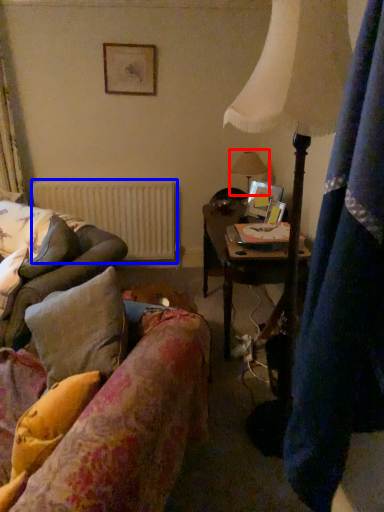
Question: Which point is closer to the camera, table lamp (highlighted by a red box) or radiator (highlighted by a blue box)?

Choices:
 (A) table lamp
 (B) radiator

Answer: (A)